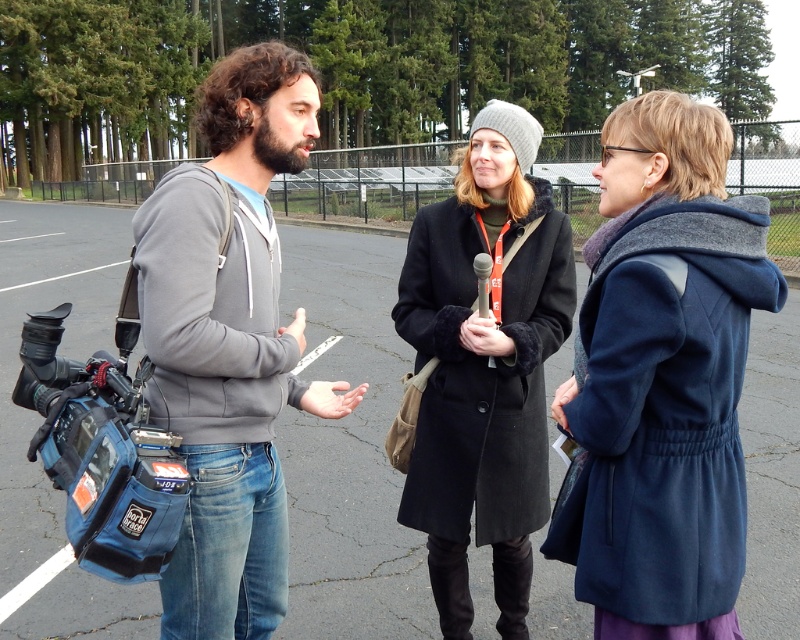
From the picture: Is asphalt pavement at center smaller than blue fabric video camera at left?

No.

Can you confirm if asphalt pavement at center is bigger than blue fabric video camera at left?

Yes.

Find the location of a particular element. asphalt pavement at center is located at coordinates (348, 449).

Between gray hoodie at center and black wool coat at center, which one has less height?

black wool coat at center

Is gray hoodie at center wider than black wool coat at center?

Yes.

Locate an element on the screen. gray hoodie at center is located at coordinates (229, 344).

You are a GUI agent. You are given a task and a screenshot of the screen. Output one action in this format:
    pyautogui.click(x=<x>, y=<y>)
    Task: Click on the gray hoodie at center
    
    Given the screenshot: What is the action you would take?
    (229, 344)

Who is positioned more to the right, navy wool coat at center or black wool coat at center?

navy wool coat at center

Between point (576, 538) and point (496, 364), which one is positioned behind?

Point (496, 364)

What do you see at coordinates (662, 378) in the screenshot?
I see `navy wool coat at center` at bounding box center [662, 378].

At what (x,y) coordinates should I click in order to perform the action: click on navy wool coat at center. Please return your answer as a coordinate pair (x, y). The image size is (800, 640). Looking at the image, I should click on (662, 378).